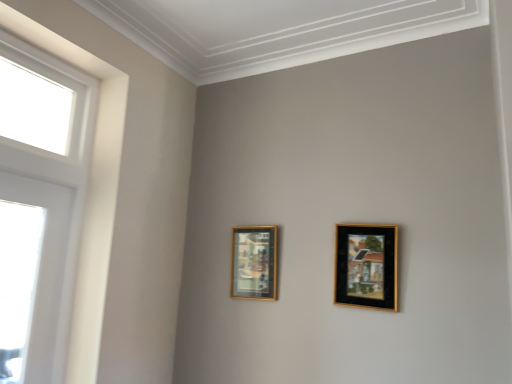
The image size is (512, 384). What are the coordinates of `white glossy window at left` in the screenshot? It's located at (88, 191).

You are a GUI agent. You are given a task and a screenshot of the screen. Output one action in this format:
    pyautogui.click(x=<x>, y=<y>)
    Task: Click on the gold-framed picture at center-left, which is counted as the first picture frame, starting from the back
    
    Given the screenshot: What is the action you would take?
    pyautogui.click(x=254, y=262)

Who is taller, black matte picture frame at upper right, the 2th picture frame viewed from the back, or white glossy window at left?

white glossy window at left.

Could you tell me if black matte picture frame at upper right, the 1th picture frame when ordered from right to left, is facing white glossy window at left?

No, black matte picture frame at upper right, the 1th picture frame when ordered from right to left, is not aimed at white glossy window at left.

From the picture: Which object is thinner, black matte picture frame at upper right, the 2th picture frame viewed from the back, or white glossy window at left?

black matte picture frame at upper right, the 2th picture frame viewed from the back.

Does point (381, 282) appear closer or farther from the camera than point (84, 212)?

Clearly, point (381, 282) is closer to the camera than point (84, 212).

Which is correct: gold-framed picture at center-left, which is counted as the first picture frame, starting from the back, is inside white glossy window at left, or outside of it?

gold-framed picture at center-left, which is counted as the first picture frame, starting from the back, exists outside the volume of white glossy window at left.

From the image's perspective, is gold-framed picture at center-left, placed as the first picture frame when sorted from left to right, on top of white glossy window at left?

No, from the image's perspective, gold-framed picture at center-left, placed as the first picture frame when sorted from left to right, is not over white glossy window at left.

Which object is positioned more to the right, gold-framed picture at center-left, placed as the first picture frame when sorted from left to right, or white glossy window at left?

gold-framed picture at center-left, placed as the first picture frame when sorted from left to right, is more to the right.

In terms of width, does gold-framed picture at center-left, which appears as the second picture frame when viewed from the right, look wider or thinner when compared to white glossy window at left?

In the image, gold-framed picture at center-left, which appears as the second picture frame when viewed from the right, appears to be more narrow than white glossy window at left.

From the image's perspective, is white glossy window at left above black matte picture frame at upper right, which is the first picture frame from front to back?

Yes, from the image's perspective, white glossy window at left is above black matte picture frame at upper right, which is the first picture frame from front to back.

Is point (91, 257) behind point (383, 282)?

Yes, point (91, 257) is farther from viewer.

Which of these two, white glossy window at left or black matte picture frame at upper right, which is counted as the 2th picture frame, starting from the left, is thinner?

With smaller width is black matte picture frame at upper right, which is counted as the 2th picture frame, starting from the left.

Is white glossy window at left completely or partially outside of black matte picture frame at upper right, the 1th picture frame when ordered from right to left?

Yes.

Is black matte picture frame at upper right, which is the first picture frame from front to back, not inside gold-framed picture at center-left, the second picture frame in the front-to-back sequence?

Indeed, black matte picture frame at upper right, which is the first picture frame from front to back, is completely outside gold-framed picture at center-left, the second picture frame in the front-to-back sequence.

Considering the relative sizes of black matte picture frame at upper right, the 2th picture frame viewed from the back, and gold-framed picture at center-left, placed as the first picture frame when sorted from left to right, in the image provided, is black matte picture frame at upper right, the 2th picture frame viewed from the back, shorter than gold-framed picture at center-left, placed as the first picture frame when sorted from left to right,?

In fact, black matte picture frame at upper right, the 2th picture frame viewed from the back, may be taller than gold-framed picture at center-left, placed as the first picture frame when sorted from left to right.

Can you confirm if black matte picture frame at upper right, the 2th picture frame viewed from the back, is positioned to the right of gold-framed picture at center-left, placed as the first picture frame when sorted from left to right?

Correct, you'll find black matte picture frame at upper right, the 2th picture frame viewed from the back, to the right of gold-framed picture at center-left, placed as the first picture frame when sorted from left to right.

From a real-world perspective, is black matte picture frame at upper right, the 1th picture frame when ordered from right to left, positioned above or below gold-framed picture at center-left, placed as the first picture frame when sorted from left to right?

Result: Clearly, from a real-world perspective, black matte picture frame at upper right, the 1th picture frame when ordered from right to left, is above gold-framed picture at center-left, placed as the first picture frame when sorted from left to right.

Does gold-framed picture at center-left, which is counted as the first picture frame, starting from the back, lie behind black matte picture frame at upper right, the 1th picture frame when ordered from right to left?

Yes, gold-framed picture at center-left, which is counted as the first picture frame, starting from the back, is further from the camera.

From the image's perspective, which one is positioned higher, gold-framed picture at center-left, placed as the first picture frame when sorted from left to right, or black matte picture frame at upper right, which is counted as the 2th picture frame, starting from the left?

black matte picture frame at upper right, which is counted as the 2th picture frame, starting from the left, appears higher in the image.

Can you tell me how much gold-framed picture at center-left, which is counted as the first picture frame, starting from the back, and black matte picture frame at upper right, which is the first picture frame from front to back, differ in facing direction?

They differ by 0.762 degrees in their facing directions.

Does gold-framed picture at center-left, placed as the first picture frame when sorted from left to right, have a lesser height compared to black matte picture frame at upper right, which is counted as the 2th picture frame, starting from the left?

Indeed, gold-framed picture at center-left, placed as the first picture frame when sorted from left to right, has a lesser height compared to black matte picture frame at upper right, which is counted as the 2th picture frame, starting from the left.

Between white glossy window at left and gold-framed picture at center-left, which is counted as the first picture frame, starting from the back, which one has larger size?

With larger size is white glossy window at left.

Is point (77, 314) less distant than point (276, 277)?

Yes, point (77, 314) is in front of point (276, 277).

Which object is thinner, white glossy window at left or gold-framed picture at center-left, which is counted as the first picture frame, starting from the back?

gold-framed picture at center-left, which is counted as the first picture frame, starting from the back, is thinner.

This screenshot has height=384, width=512. Find the location of `the 1st picture frame below when counting from the white glossy window at left (from the image's perspective)`. the 1st picture frame below when counting from the white glossy window at left (from the image's perspective) is located at coordinates (366, 266).

Starting from the white glossy window at left, which picture frame is the 1st one to the right? Please provide its 2D coordinates.

[(254, 262)]

From the image, which object appears to be farther from gold-framed picture at center-left, the second picture frame in the front-to-back sequence, white glossy window at left or black matte picture frame at upper right, which is the first picture frame from front to back?

Based on the image, white glossy window at left appears to be further to gold-framed picture at center-left, the second picture frame in the front-to-back sequence.

When comparing their distances from white glossy window at left, does gold-framed picture at center-left, the second picture frame in the front-to-back sequence, or black matte picture frame at upper right, the 2th picture frame viewed from the back, seem further?

black matte picture frame at upper right, the 2th picture frame viewed from the back.

Which object lies nearer to the anchor point white glossy window at left, black matte picture frame at upper right, the 2th picture frame viewed from the back, or gold-framed picture at center-left, which is counted as the first picture frame, starting from the back?

Based on the image, gold-framed picture at center-left, which is counted as the first picture frame, starting from the back, appears to be nearer to white glossy window at left.

Which object lies nearer to the anchor point black matte picture frame at upper right, the 2th picture frame viewed from the back, gold-framed picture at center-left, which appears as the second picture frame when viewed from the right, or white glossy window at left?

Based on the image, gold-framed picture at center-left, which appears as the second picture frame when viewed from the right, appears to be nearer to black matte picture frame at upper right, the 2th picture frame viewed from the back.

Which object lies nearer to the anchor point black matte picture frame at upper right, the 1th picture frame when ordered from right to left, white glossy window at left or gold-framed picture at center-left, which is counted as the first picture frame, starting from the back?

gold-framed picture at center-left, which is counted as the first picture frame, starting from the back.

Based on their spatial positions, is black matte picture frame at upper right, the 2th picture frame viewed from the back, or white glossy window at left closer to gold-framed picture at center-left, the second picture frame in the front-to-back sequence?

Based on the image, black matte picture frame at upper right, the 2th picture frame viewed from the back, appears to be nearer to gold-framed picture at center-left, the second picture frame in the front-to-back sequence.

Where is `picture frame situated between white glossy window at left and black matte picture frame at upper right, which is the first picture frame from front to back, from left to right`? Image resolution: width=512 pixels, height=384 pixels. picture frame situated between white glossy window at left and black matte picture frame at upper right, which is the first picture frame from front to back, from left to right is located at coordinates (254, 262).